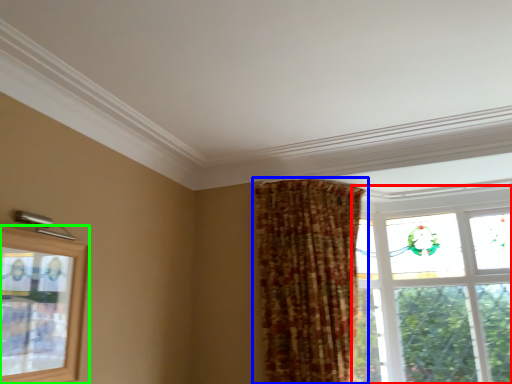
Question: Which is nearer to the window (highlighted by a red box)? curtain (highlighted by a blue box) or window (highlighted by a green box).

Choices:
 (A) curtain
 (B) window

Answer: (A)